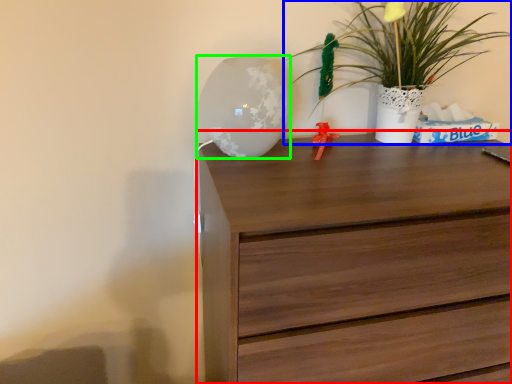
Question: Which object is positioned closest to chest of drawers (highlighted by a red box)? Select from houseplant (highlighted by a blue box) and table lamp (highlighted by a green box).

Choices:
 (A) houseplant
 (B) table lamp

Answer: (B)